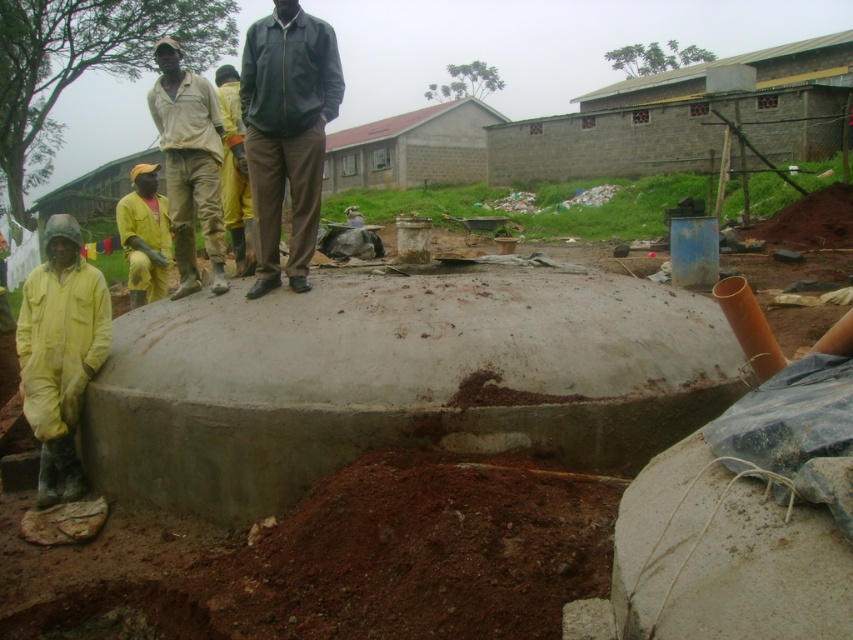
Question: Is dark green jacket at center further to the viewer compared to yellow rubber suit at lower left?

Choices:
 (A) yes
 (B) no

Answer: (A)

Question: Which point is closer to the camera?

Choices:
 (A) 57,280
 (B) 231,132
 (C) 207,102

Answer: (A)

Question: In this image, where is light beige fabric shirt at center located relative to yellow rubber boots at center?

Choices:
 (A) right
 (B) left

Answer: (B)

Question: Estimate the real-world distances between objects in this image. Which object is closer to the yellow matte construction worker at lower left?

Choices:
 (A) dark green jacket at center
 (B) yellow rubber boots at center
 (C) light beige fabric shirt at center
 (D) yellow rubber suit at lower left

Answer: (C)

Question: Is dark green jacket at center to the left of light beige fabric shirt at center from the viewer's perspective?

Choices:
 (A) no
 (B) yes

Answer: (A)

Question: Which object appears closest to the camera in this image?

Choices:
 (A) yellow rubber boots at center
 (B) light beige fabric shirt at center

Answer: (B)